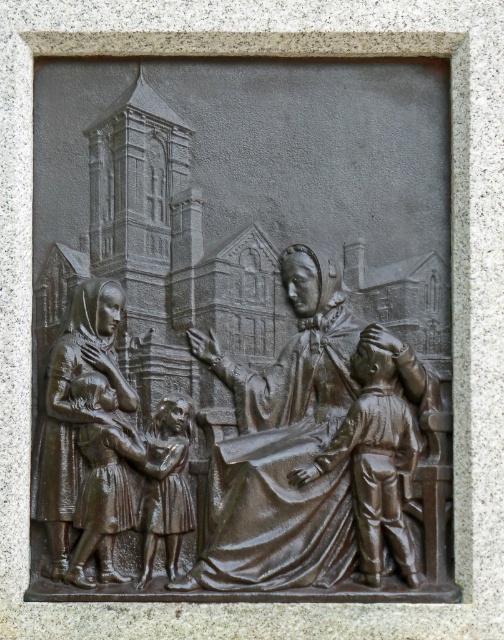
You are a tour guide leading a group near the stone frame that contains the bronze relief sculpture. You want to point out the matte bronze statue at left and the bronze statue of woman at center to your group. If your arm can reach 2 meters, can you touch both statues with your outstretched hand at the same time while standing between them?

The distance between the matte bronze statue at left and the bronze statue of woman at center is 2.53 meters. Since your arm can only reach 2 meters, you cannot touch both statues at the same time while standing between them.